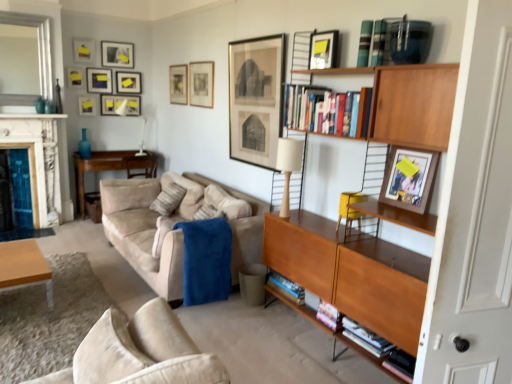
Locate an element on the screen. The image size is (512, 384). free point above matte black picture frame at upper center, which ranks as the third picture frame in front-to-back order (from a real-world perspective) is located at coordinates (259, 36).